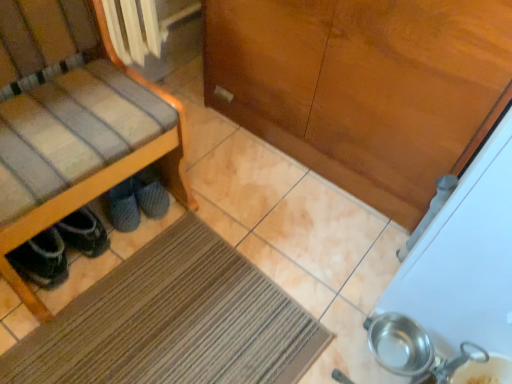
Where is `free space that is in between wooden cabinet at center and gray fuzzy slippers at lower left, which is the 1th footwear in back-to-front order`? free space that is in between wooden cabinet at center and gray fuzzy slippers at lower left, which is the 1th footwear in back-to-front order is located at coordinates (258, 190).